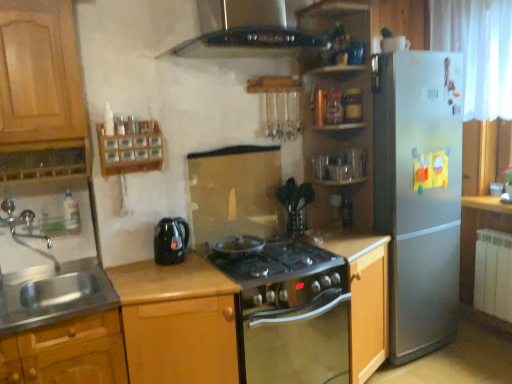
The height and width of the screenshot is (384, 512). I want to click on black glossy electric kettle at center-left, so click(170, 240).

Where is `black glass stove at center`? Image resolution: width=512 pixels, height=384 pixels. black glass stove at center is located at coordinates (291, 313).

Image resolution: width=512 pixels, height=384 pixels. In order to click on wooden spice rack at upper left in this screenshot , I will do `click(131, 149)`.

The width and height of the screenshot is (512, 384). I want to click on black glossy electric kettle at center-left, so [170, 240].

Do you think black glass stove at center is within black glass exhaust hood at upper center, or outside of it?

black glass stove at center lies outside black glass exhaust hood at upper center.

Is point (312, 313) positioned after point (247, 15)?

No, (312, 313) is closer to viewer.

Considering the relative sizes of black glass stove at center and black glass exhaust hood at upper center in the image provided, is black glass stove at center shorter than black glass exhaust hood at upper center?

No.

Considering the sizes of wooden cabinet at center, placed as the third cabinetry when sorted from left to right, and stainless steel sink at lower left in the image, is wooden cabinet at center, placed as the third cabinetry when sorted from left to right, taller or shorter than stainless steel sink at lower left?

Clearly, wooden cabinet at center, placed as the third cabinetry when sorted from left to right, is taller compared to stainless steel sink at lower left.

From the image's perspective, relative to stainless steel sink at lower left, is wooden cabinet at center, the first cabinetry when ordered from right to left, above or below?

Based on their image positions, wooden cabinet at center, the first cabinetry when ordered from right to left, is located beneath stainless steel sink at lower left.

Considering the positions of objects wooden cabinet at center, the first cabinetry when ordered from right to left, and stainless steel sink at lower left in the image provided, who is more to the left, wooden cabinet at center, the first cabinetry when ordered from right to left, or stainless steel sink at lower left?

stainless steel sink at lower left is more to the left.

From the picture: Considering the sizes of black glossy electric kettle at center-left and wooden cabinet at center, which is counted as the second cabinetry, starting from the right, in the image, is black glossy electric kettle at center-left wider or thinner than wooden cabinet at center, which is counted as the second cabinetry, starting from the right,?

black glossy electric kettle at center-left is thinner than wooden cabinet at center, which is counted as the second cabinetry, starting from the right.

Is black glossy electric kettle at center-left in front of wooden cabinet at center, the second cabinetry viewed from the left?

→ No, the depth of black glossy electric kettle at center-left is greater than that of wooden cabinet at center, the second cabinetry viewed from the left.

From a real-world perspective, which object rests below the other?

wooden cabinet at center, which is counted as the second cabinetry, starting from the right, is physically lower.

The image size is (512, 384). I want to click on kitchen appliance on the left side of wooden cabinet at center, the second cabinetry viewed from the left, so click(x=170, y=240).

From a real-world perspective, is wooden cabinet at center, which is counted as the second cabinetry, starting from the right, on top of black glass stove at center?

Yes, from a real-world perspective, wooden cabinet at center, which is counted as the second cabinetry, starting from the right, is above black glass stove at center.

Is wooden cabinet at center, the second cabinetry viewed from the left, next to black glass stove at center?

No, wooden cabinet at center, the second cabinetry viewed from the left, is not touching black glass stove at center.

Is wooden cabinet at center, the second cabinetry viewed from the left, closer to camera compared to black glass stove at center?

Yes, wooden cabinet at center, the second cabinetry viewed from the left, is closer to the camera.

Is black glass stove at center surrounded by wooden cabinet at center, which is counted as the second cabinetry, starting from the right?

Actually, black glass stove at center is outside wooden cabinet at center, which is counted as the second cabinetry, starting from the right.

From a real-world perspective, which object rests below the other?

In real-world perspective, wooden cabinet at center, the first cabinetry when ordered from right to left, is lower.

Is wooden shelves at upper right facing away from wooden cabinet at center, the first cabinetry when ordered from right to left?

No, wooden shelves at upper right is not facing away from wooden cabinet at center, the first cabinetry when ordered from right to left.

Locate an element on the screen. cabinet above the wooden cabinet at center, placed as the third cabinetry when sorted from left to right (from the image's perspective) is located at coordinates (342, 117).

Which object is positioned more to the right, stainless steel sink at lower left or wooden cabinet at center, which is counted as the second cabinetry, starting from the right?

From the viewer's perspective, wooden cabinet at center, which is counted as the second cabinetry, starting from the right, appears more on the right side.

Is stainless steel sink at lower left wider than wooden cabinet at center, the second cabinetry viewed from the left?

Yes, stainless steel sink at lower left is wider than wooden cabinet at center, the second cabinetry viewed from the left.

Could you tell me if stainless steel sink at lower left is facing wooden cabinet at center, which is counted as the second cabinetry, starting from the right?

No, stainless steel sink at lower left is not facing towards wooden cabinet at center, which is counted as the second cabinetry, starting from the right.

Are wooden cabinet at center, which is counted as the second cabinetry, starting from the right, and wooden spice rack at upper left beside each other?

wooden cabinet at center, which is counted as the second cabinetry, starting from the right, is not next to wooden spice rack at upper left, and they're not touching.

Considering the sizes of objects wooden cabinet at center, which is counted as the second cabinetry, starting from the right, and wooden spice rack at upper left in the image provided, who is taller, wooden cabinet at center, which is counted as the second cabinetry, starting from the right, or wooden spice rack at upper left?

With more height is wooden cabinet at center, which is counted as the second cabinetry, starting from the right.

Looking at this image, is wooden spice rack at upper left at the back of wooden cabinet at center, which is counted as the second cabinetry, starting from the right?

No, wooden cabinet at center, which is counted as the second cabinetry, starting from the right, is not facing away from wooden spice rack at upper left.

What's the angular difference between wooden cabinet at center, which is counted as the second cabinetry, starting from the right, and wooden spice rack at upper left's facing directions?

The angle between the facing direction of wooden cabinet at center, which is counted as the second cabinetry, starting from the right, and the facing direction of wooden spice rack at upper left is 3.56 degrees.

Find the location of a particular element. The height and width of the screenshot is (384, 512). exhaust hood that is above the black glass stove at center (from the image's perspective) is located at coordinates (245, 32).

Identify the location of cabinetry that is the 1st one when counting downward from the stainless steel sink at lower left (from the image's perspective). This screenshot has height=384, width=512. (365, 299).

Based on their spatial positions, is wooden shelves at upper right or black glass exhaust hood at upper center closer to black glossy electric kettle at center-left?

black glass exhaust hood at upper center is closer to black glossy electric kettle at center-left.

Considering their positions, is wooden cabinet at center, placed as the third cabinetry when sorted from left to right, positioned further to wooden cabinet at center, which is counted as the second cabinetry, starting from the right, than black glass exhaust hood at upper center?

Answer: black glass exhaust hood at upper center.

Estimate the real-world distances between objects in this image. Which object is closer to silver metallic refrigerator at right, wooden shelves at upper right or wooden cabinet at center, the second cabinetry viewed from the left?

The object closer to silver metallic refrigerator at right is wooden shelves at upper right.

Based on their spatial positions, is silver metallic refrigerator at right or metallic oak cabinet at lower left, which is the 3th cabinetry in right-to-left order, closer to wooden cabinet at center, placed as the third cabinetry when sorted from left to right?

Among the two, silver metallic refrigerator at right is located nearer to wooden cabinet at center, placed as the third cabinetry when sorted from left to right.

Which object lies nearer to the anchor point black glossy electric kettle at center-left, wooden spice rack at upper left or wooden shelves at upper right?

Among the two, wooden spice rack at upper left is located nearer to black glossy electric kettle at center-left.

Looking at the image, which one is located closer to black glossy electric kettle at center-left, wooden shelves at upper right or metallic oak cabinet at lower left, which is the 3th cabinetry in right-to-left order?

metallic oak cabinet at lower left, which is the 3th cabinetry in right-to-left order, lies closer to black glossy electric kettle at center-left than the other object.

When comparing their distances from silver metallic refrigerator at right, does wooden spice rack at upper left or wooden cabinet at center, which is counted as the second cabinetry, starting from the right, seem further?

The object further to silver metallic refrigerator at right is wooden spice rack at upper left.

Estimate the real-world distances between objects in this image. Which object is closer to metallic oak cabinet at lower left, which is the 3th cabinetry in right-to-left order, wooden spice rack at upper left or wooden cabinet at center, the second cabinetry viewed from the left?

wooden cabinet at center, the second cabinetry viewed from the left, is closer to metallic oak cabinet at lower left, which is the 3th cabinetry in right-to-left order.

Locate an element on the screen. The height and width of the screenshot is (384, 512). kitchen appliance between wooden spice rack at upper left and wooden cabinet at center, the second cabinetry viewed from the left, vertically is located at coordinates (170, 240).

The width and height of the screenshot is (512, 384). In order to click on cabinetry between black glass stove at center and silver metallic refrigerator at right in the horizontal direction in this screenshot , I will do `click(365, 299)`.

The width and height of the screenshot is (512, 384). I want to click on oven situated between stainless steel sink at lower left and wooden shelves at upper right from left to right, so click(291, 313).

This screenshot has height=384, width=512. Find the location of `shelf between stainless steel sink at lower left and silver metallic refrigerator at right from left to right`. shelf between stainless steel sink at lower left and silver metallic refrigerator at right from left to right is located at coordinates (131, 149).